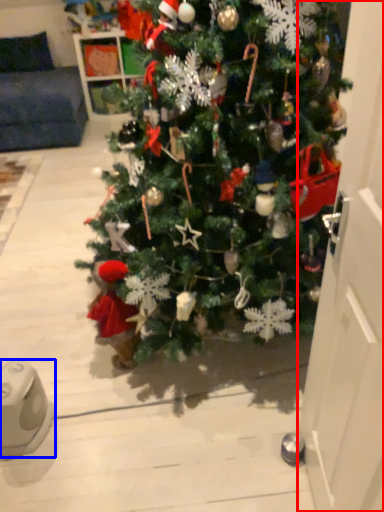
Question: Which point is closer to the camera, door (highlighted by a red box) or ipod (highlighted by a blue box)?

Choices:
 (A) door
 (B) ipod

Answer: (A)